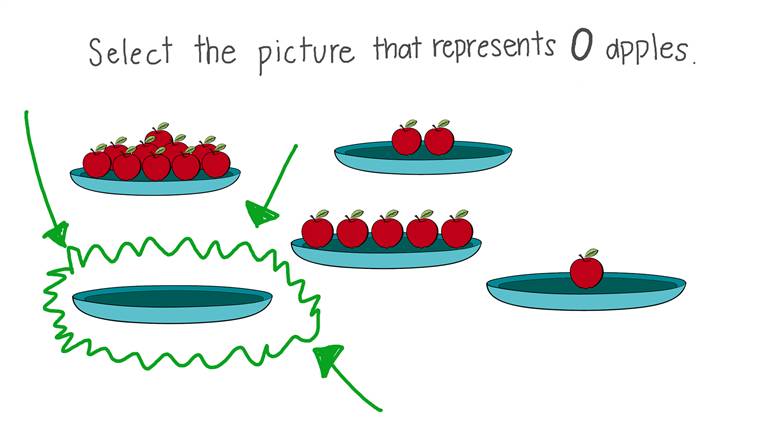
Where is `trays`? This screenshot has height=427, width=760. trays is located at coordinates (194, 301), (175, 189), (382, 260), (391, 169), (527, 301).